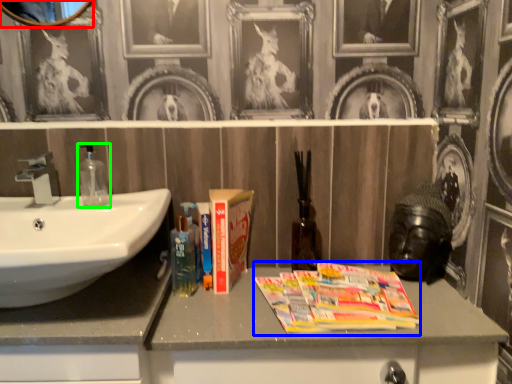
Question: Which object is the closest to the picture frame (highlighted by a red box)? Choose among these: magazine (highlighted by a blue box) or soap dispenser (highlighted by a green box).

Choices:
 (A) magazine
 (B) soap dispenser

Answer: (B)